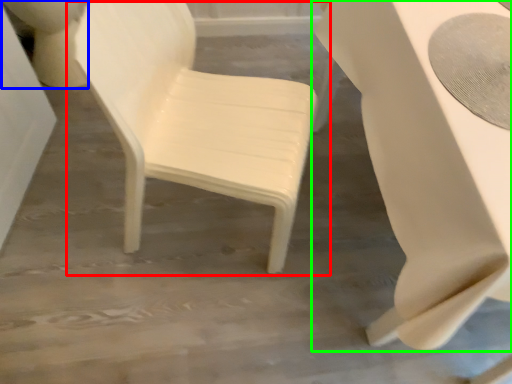
Question: Based on their relative distances, which object is nearer to chair (highlighted by a red box)? Choose from toilet bowl (highlighted by a blue box) and table (highlighted by a green box).

Choices:
 (A) toilet bowl
 (B) table

Answer: (B)